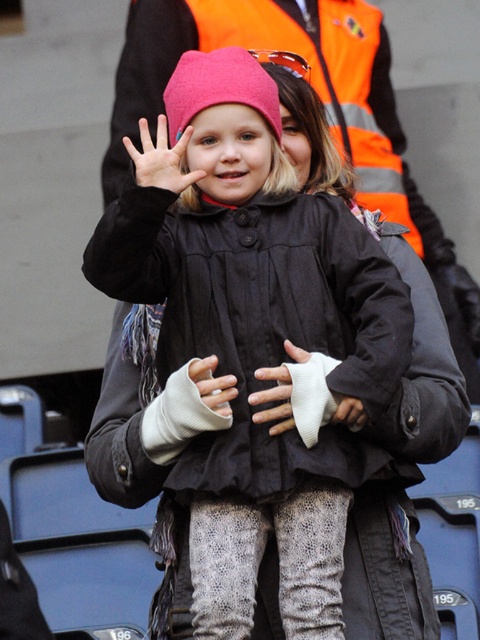
You are standing at the origin point in the image. There is a point marked at coordinates (218, 88). What object is located at that point?

The point at coordinates (218, 88) is located on the pink fabric hat at center.

You are a photographer trying to capture both the pink fabric hat at center and the matte pink beanie at upper center in a single shot. Which object is closer to your camera lens?

The pink fabric hat at center is closer to the camera lens because it is further to the viewer than the matte pink beanie at upper center.